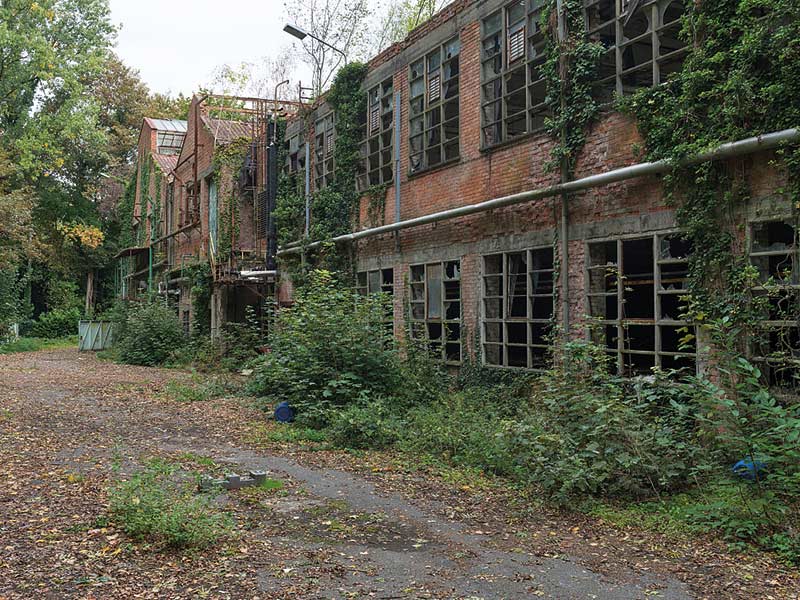
The width and height of the screenshot is (800, 600). What are the coordinates of `trash can` in the screenshot? It's located at click(281, 407), click(750, 465).